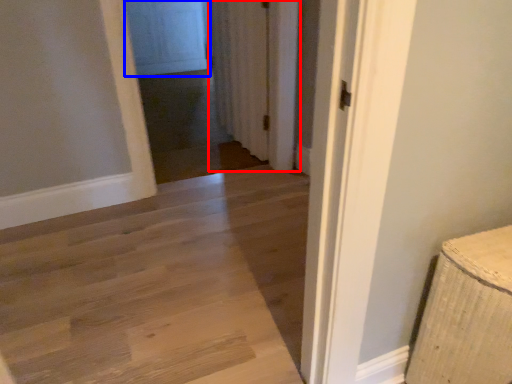
Question: Which object is further to the camera taking this photo, curtain (highlighted by a red box) or screen door (highlighted by a blue box)?

Choices:
 (A) curtain
 (B) screen door

Answer: (B)